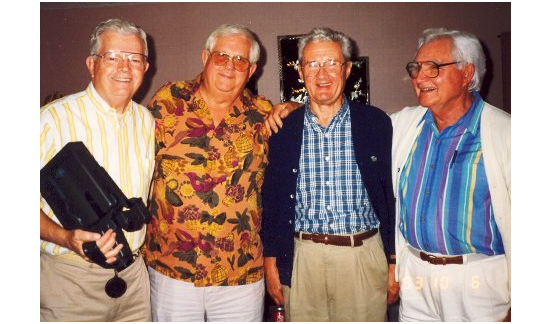
In order to click on wall in this screenshot , I will do `click(185, 37)`.